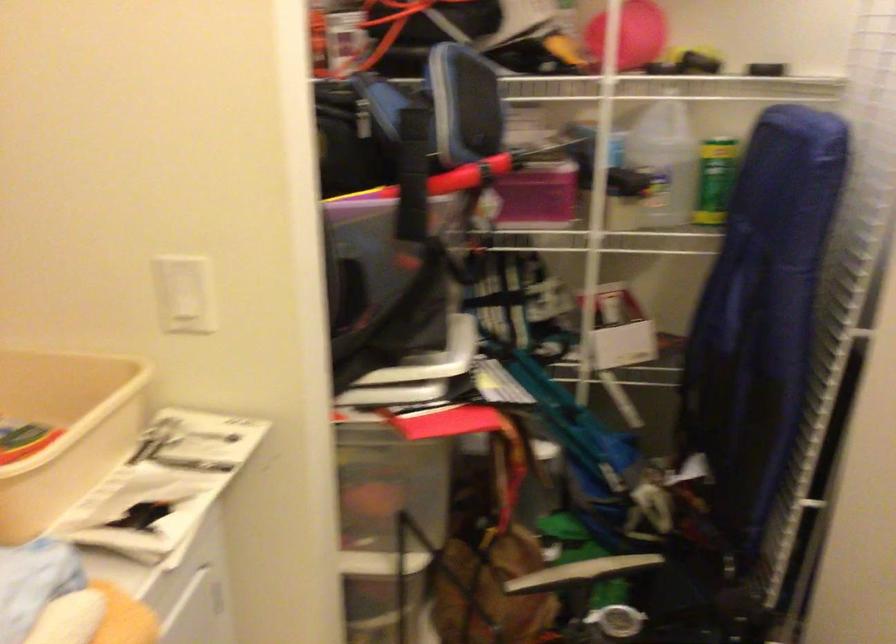
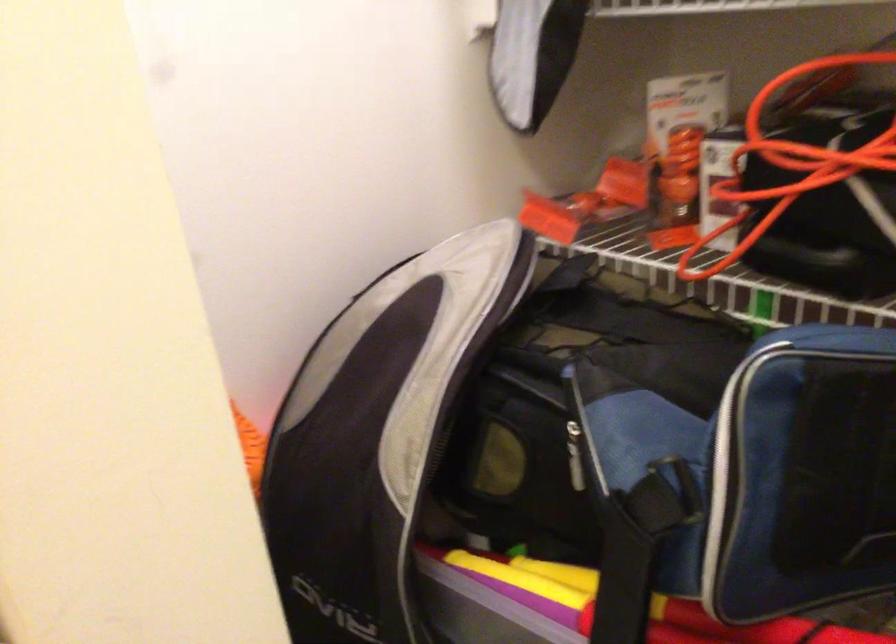
The point at (414, 129) is marked in the first image. Where is the corresponding point in the second image?

(622, 581)